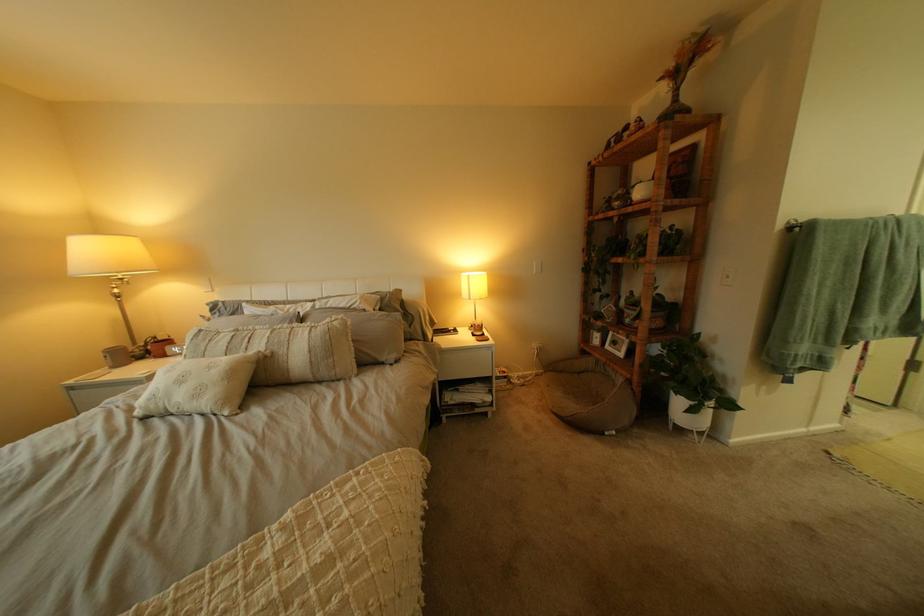
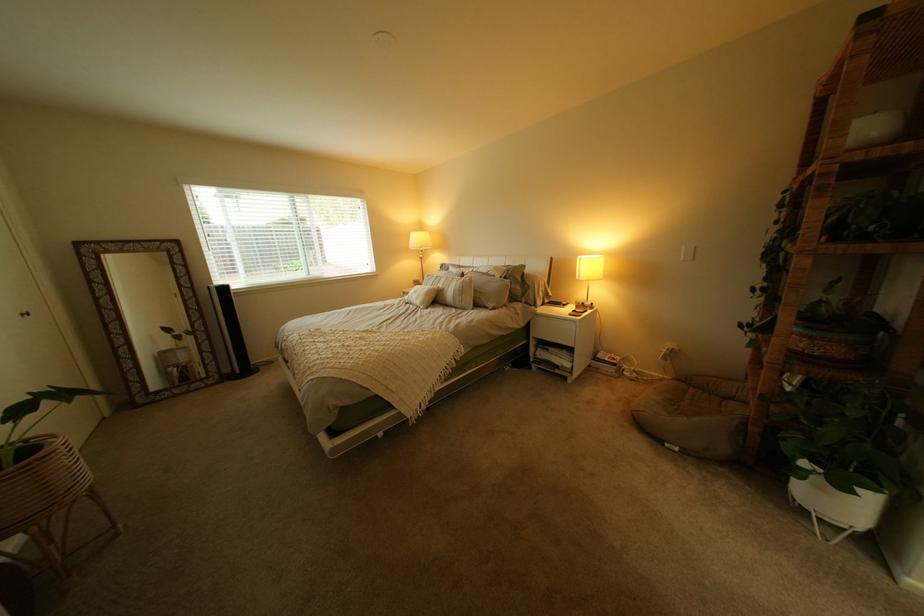
Locate, in the second image, the point that corresponds to (412,363) in the first image.

(509, 310)